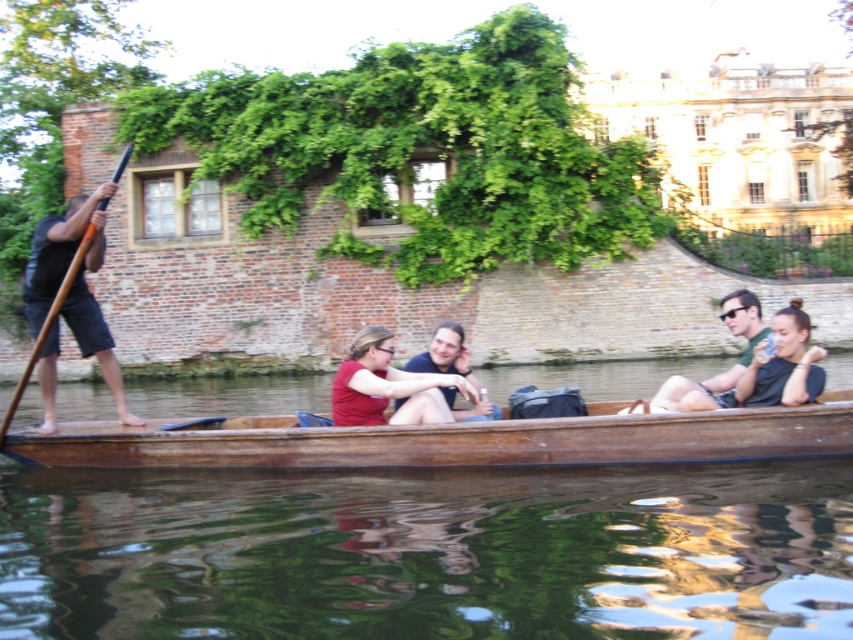
Question: Based on their relative distances, which object is farther from the wooden paddle at left?

Choices:
 (A) wooden canoe at center
 (B) matte black shirt at center
 (C) matte red shirt at center

Answer: (C)

Question: Can you confirm if matte black shirt at center is wider than wooden paddle at left?

Choices:
 (A) yes
 (B) no

Answer: (B)

Question: Which object is positioned farthest from the wooden paddle at left?

Choices:
 (A) transparent water at boat bottom
 (B) matte black shirt at center
 (C) matte red shirt at center
 (D) green fabric shirt at right

Answer: (C)

Question: Does transparent water at boat bottom appear on the right side of matte red shirt at center?

Choices:
 (A) no
 (B) yes

Answer: (A)

Question: Estimate the real-world distances between objects in this image. Which object is closer to the transparent water at boat bottom?

Choices:
 (A) matte black shirt at center
 (B) wooden paddle at left
 (C) wooden canoe at center
 (D) green fabric shirt at right

Answer: (C)

Question: In this image, where is transparent water at boat bottom located relative to matte black shirt at center?

Choices:
 (A) left
 (B) right

Answer: (A)